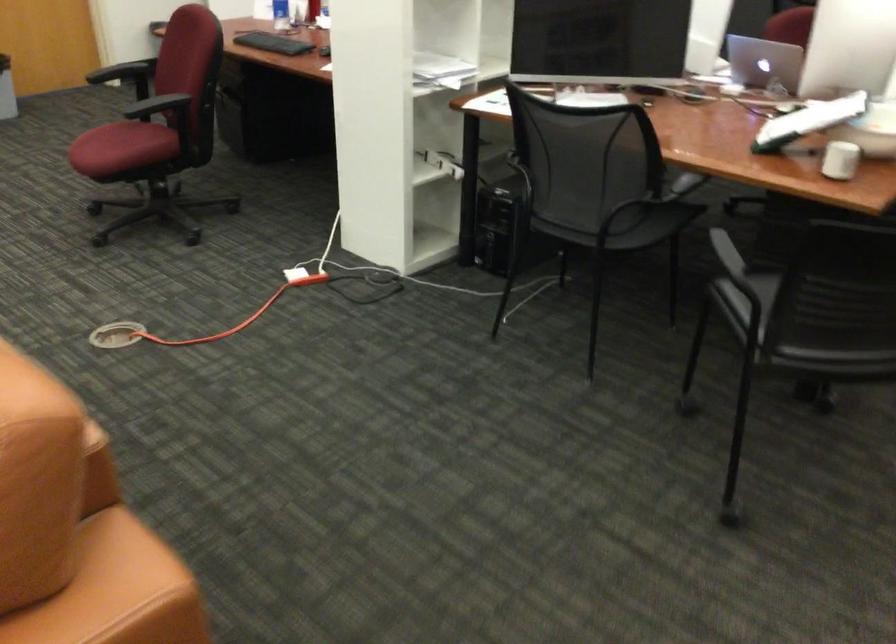
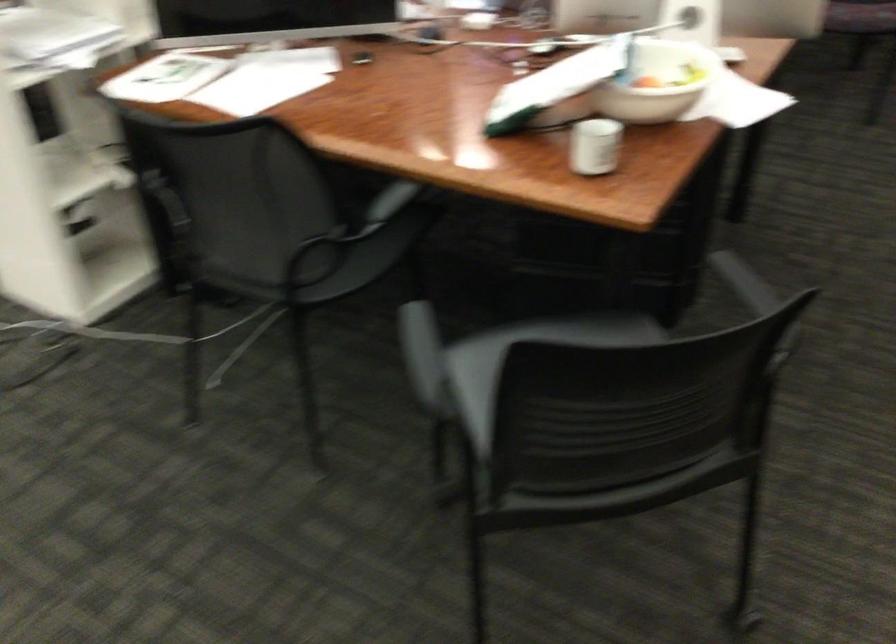
Which direction would the cameraman need to move to produce the second image?

The cameraman walked toward right, forward.